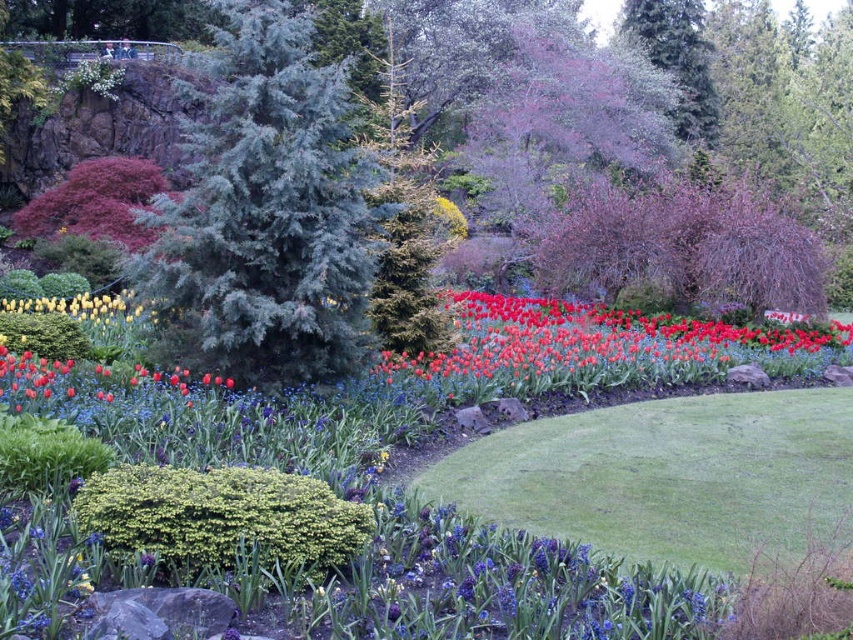
You are a gardener planning to plant a new flowerbed between the green textured bush at lower center and the green textured pine tree at center. Which of the two plants should you consider for height adjustments to ensure the flowerbed remains accessible?

The green textured bush at lower center is shorter than the green textured pine tree at center. To ensure the flowerbed remains accessible, you should consider raising the height of the green textured bush at lower center or lowering the green textured pine tree at center.

You are a gardener planning to plant a new flower bed between the green textured evergreen tree at center and the green smooth lawn at center. Considering their sizes, which area would require more space for the flower bed?

The green textured evergreen tree at center is bigger than the green smooth lawn at center, so the flower bed near the green textured evergreen tree at center would require more space.

You are a gardener who wants to plant a new flower bed. You have a space that can accommodate a plant with a width of 3 meters. You see the bright red petals at center and the green textured pine tree at center in the garden. Which of these plants can fit into the space based on their widths?

The bright red petals at center has a larger width than the green textured pine tree at center, so if the space can accommodate 3 meters, the bright red petals at center would require more space. Therefore, the green textured pine tree at center would fit better in the 3 meter space.